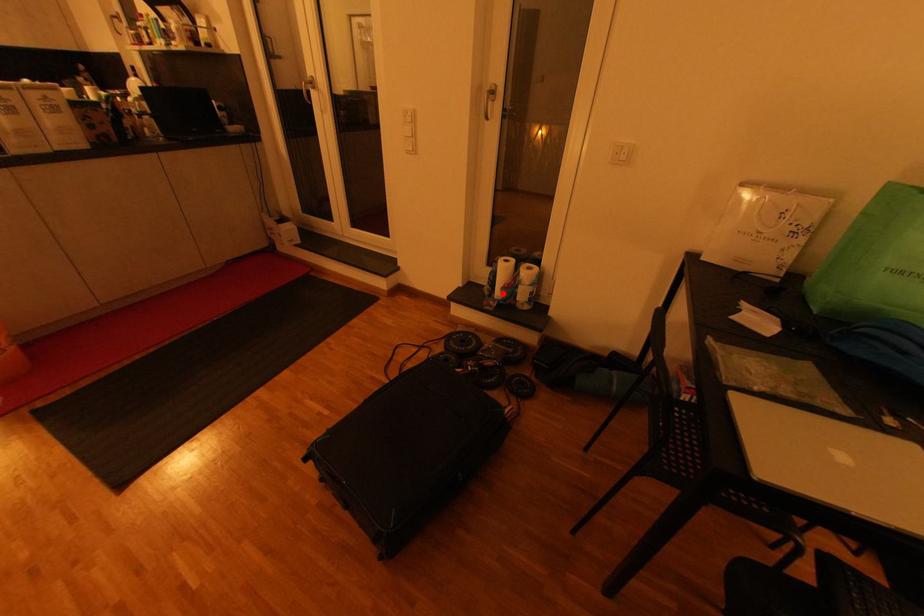
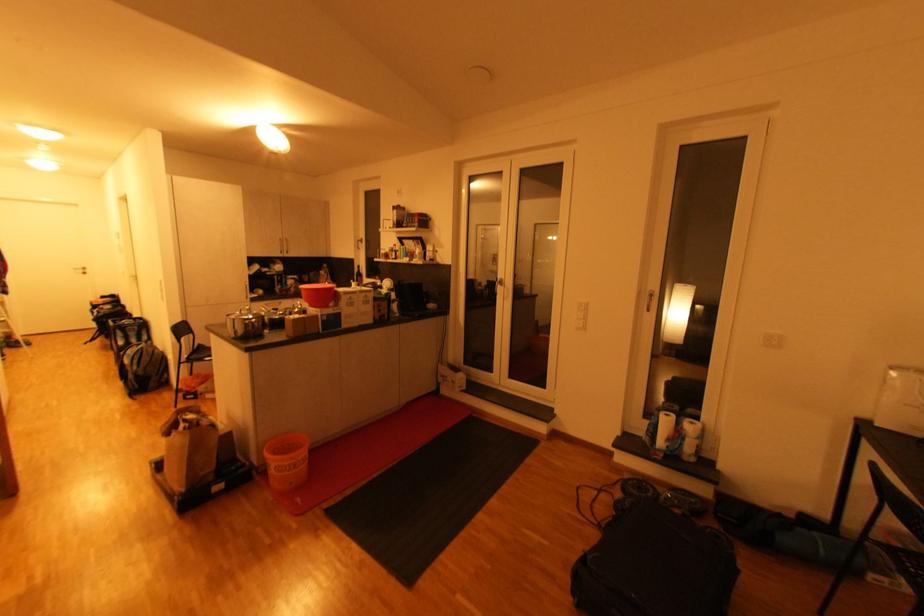
Question: I am providing you with two images of the same scene from different viewpoints. A red point is shown in image1. For the corresponding object point in image2, is it positioned nearer or farther from the camera?

Choices:
 (A) Nearer
 (B) Farther

Answer: (B)